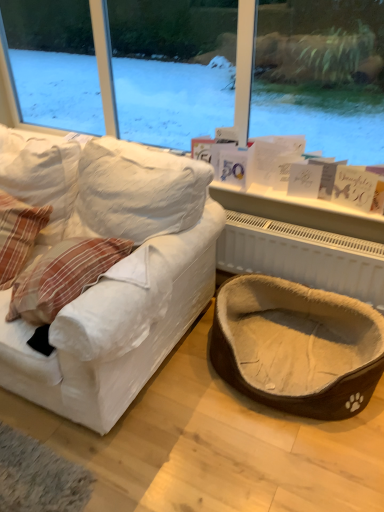
Question: From a real-world perspective, is brown fuzzy pet bed at lower right on white fabric couch at left?

Choices:
 (A) no
 (B) yes

Answer: (A)

Question: From the image's perspective, is brown fuzzy pet bed at lower right beneath white fabric couch at left?

Choices:
 (A) no
 (B) yes

Answer: (B)

Question: Is brown fuzzy pet bed at lower right thinner than white fabric couch at left?

Choices:
 (A) no
 (B) yes

Answer: (B)

Question: Is brown fuzzy pet bed at lower right in contact with white fabric couch at left?

Choices:
 (A) yes
 (B) no

Answer: (B)

Question: Considering the relative sizes of brown fuzzy pet bed at lower right and white fabric couch at left in the image provided, is brown fuzzy pet bed at lower right smaller than white fabric couch at left?

Choices:
 (A) no
 (B) yes

Answer: (B)

Question: From a real-world perspective, is white textured radiator at lower right positioned above or below white fabric couch at left?

Choices:
 (A) below
 (B) above

Answer: (A)

Question: From the image's perspective, relative to white fabric couch at left, is white textured radiator at lower right above or below?

Choices:
 (A) below
 (B) above

Answer: (A)

Question: Considering the positions of white textured radiator at lower right and white fabric couch at left in the image, is white textured radiator at lower right bigger or smaller than white fabric couch at left?

Choices:
 (A) small
 (B) big

Answer: (A)

Question: Is white textured radiator at lower right taller or shorter than white fabric couch at left?

Choices:
 (A) tall
 (B) short

Answer: (B)

Question: Looking at their shapes, would you say brown fuzzy pet bed at lower right is wider or thinner than white textured radiator at lower right?

Choices:
 (A) thin
 (B) wide

Answer: (B)

Question: Considering the positions of brown fuzzy pet bed at lower right and white textured radiator at lower right in the image, is brown fuzzy pet bed at lower right taller or shorter than white textured radiator at lower right?

Choices:
 (A) short
 (B) tall

Answer: (A)

Question: In terms of size, does brown fuzzy pet bed at lower right appear bigger or smaller than white textured radiator at lower right?

Choices:
 (A) small
 (B) big

Answer: (B)

Question: Is point (375, 375) closer or farther from the camera than point (271, 240)?

Choices:
 (A) farther
 (B) closer

Answer: (B)

Question: From a real-world perspective, relative to white textured radiator at lower right, is white fabric couch at left vertically above or below?

Choices:
 (A) below
 (B) above

Answer: (B)

Question: Is white fabric couch at left to the left or to the right of white textured radiator at lower right in the image?

Choices:
 (A) right
 (B) left

Answer: (B)